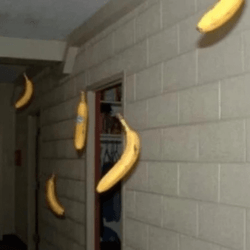
This screenshot has width=250, height=250. Identify the location of brick wall. (159, 214), (75, 188).